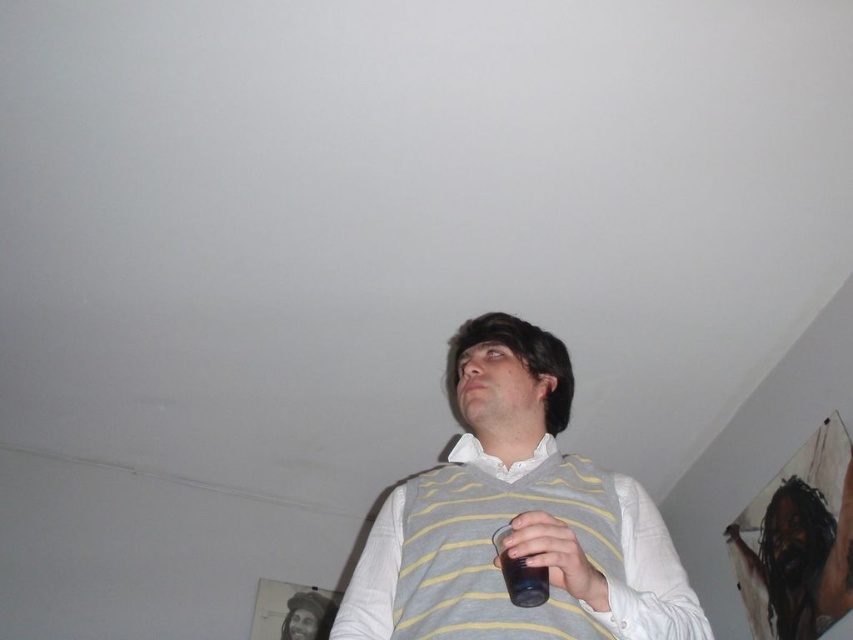
Question: Based on their relative distances, which object is farther from the matte black cup at lower center?

Choices:
 (A) gray striped sweater at center
 (B) yellow striped sweater vest at center
 (C) transparent plastic cup at center

Answer: (A)

Question: Can you confirm if matte black cup at lower center is bigger than transparent plastic cup at center?

Choices:
 (A) no
 (B) yes

Answer: (B)

Question: Which point is closer to the camera?

Choices:
 (A) (837, 573)
 (B) (515, 564)
 (C) (547, 524)
 (D) (660, 554)

Answer: (B)

Question: Does yellow striped sweater vest at center appear over matte black cup at lower center?

Choices:
 (A) no
 (B) yes

Answer: (B)

Question: Which object is the farthest from the transparent plastic cup at center?

Choices:
 (A) matte black cup at lower center
 (B) yellow striped sweater vest at center
 (C) gray striped sweater at center

Answer: (C)

Question: Does yellow striped sweater vest at center have a lesser width compared to gray striped sweater at center?

Choices:
 (A) no
 (B) yes

Answer: (A)